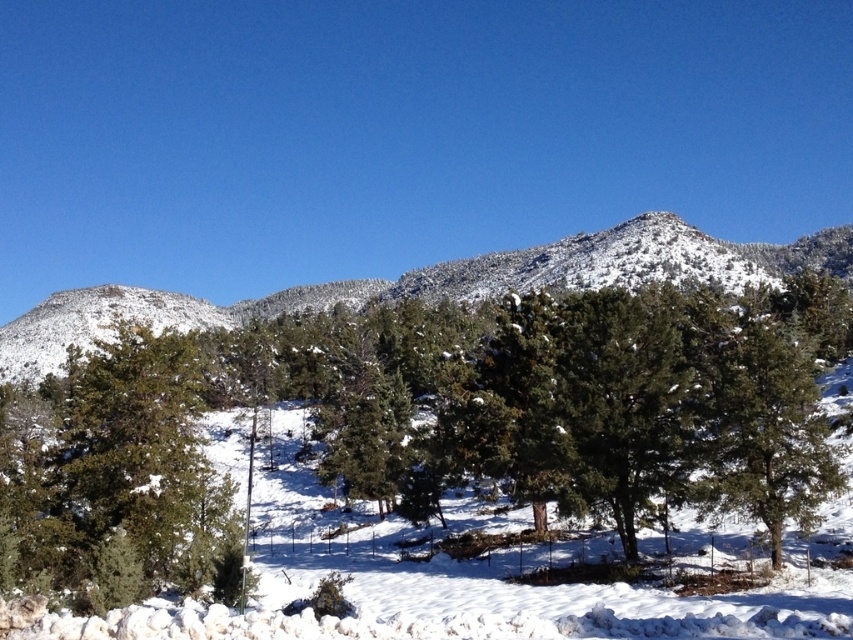
You are standing in the winter landscape and want to walk from the green matte tree at left to the snowy pine trees at center. Which direction should you move?

You should move to the right towards the snowy pine trees at center because the green matte tree at left is located to the left of them.

You are planning to build a small cabin in this winter landscape. You need to choose between placing it near the green matte tree at left or the snowy pine trees at center. Considering their heights, which location would provide better visibility for the cabin?

The snowy pine trees at center are taller than the green matte tree at left. Placing the cabin near the green matte tree at left would provide better visibility since it is shorter, allowing the cabin to be seen from a greater distance without obstruction.